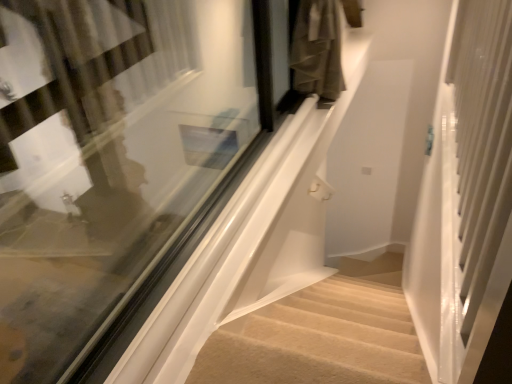
Question: From the image's perspective, does white glossy screen door at right appear higher than beige carpeted stairs at lower center?

Choices:
 (A) yes
 (B) no

Answer: (A)

Question: Can you confirm if white glossy screen door at right is wider than beige carpeted stairs at lower center?

Choices:
 (A) no
 (B) yes

Answer: (B)

Question: Can you confirm if white glossy screen door at right is thinner than beige carpeted stairs at lower center?

Choices:
 (A) no
 (B) yes

Answer: (A)

Question: Can you confirm if white glossy screen door at right is shorter than beige carpeted stairs at lower center?

Choices:
 (A) no
 (B) yes

Answer: (A)

Question: Is white glossy screen door at right completely or partially outside of beige carpeted stairs at lower center?

Choices:
 (A) yes
 (B) no

Answer: (A)

Question: Is white glossy screen door at right positioned far away from beige carpeted stairs at lower center?

Choices:
 (A) no
 (B) yes

Answer: (A)

Question: From the image's perspective, does clear glass window at center appear higher than beige carpeted stairs at lower center?

Choices:
 (A) yes
 (B) no

Answer: (A)

Question: Is clear glass window at center next to beige carpeted stairs at lower center and touching it?

Choices:
 (A) yes
 (B) no

Answer: (B)

Question: From the image's perspective, is clear glass window at center beneath beige carpeted stairs at lower center?

Choices:
 (A) yes
 (B) no

Answer: (B)

Question: Is clear glass window at center thinner than beige carpeted stairs at lower center?

Choices:
 (A) yes
 (B) no

Answer: (B)

Question: Can you confirm if clear glass window at center is positioned to the right of beige carpeted stairs at lower center?

Choices:
 (A) yes
 (B) no

Answer: (A)

Question: From a real-world perspective, is clear glass window at center beneath beige carpeted stairs at lower center?

Choices:
 (A) yes
 (B) no

Answer: (B)

Question: From a real-world perspective, is beige carpeted stairs at lower center under white glossy screen door at right?

Choices:
 (A) yes
 (B) no

Answer: (A)